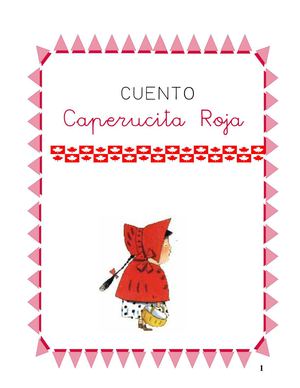
Identify the location of basket. (152, 320).